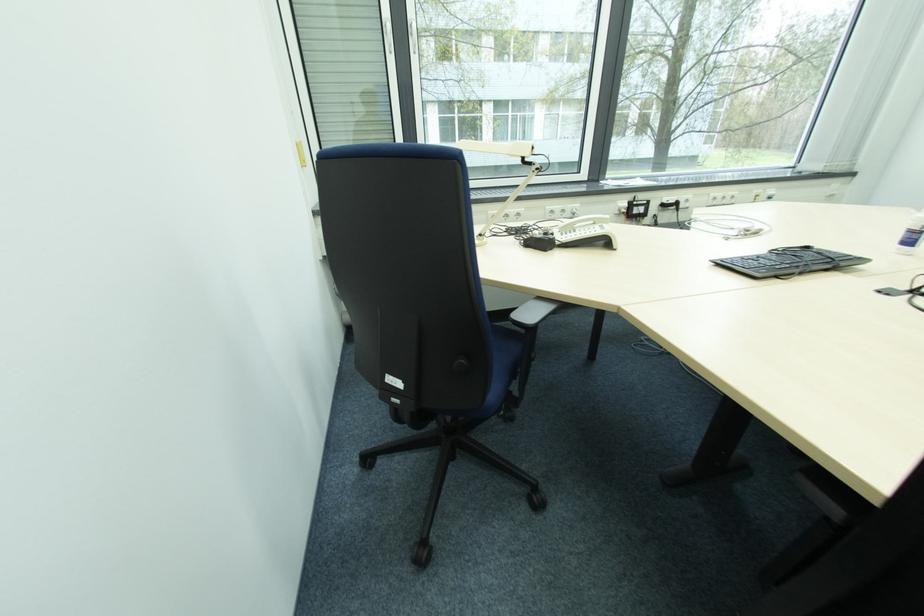
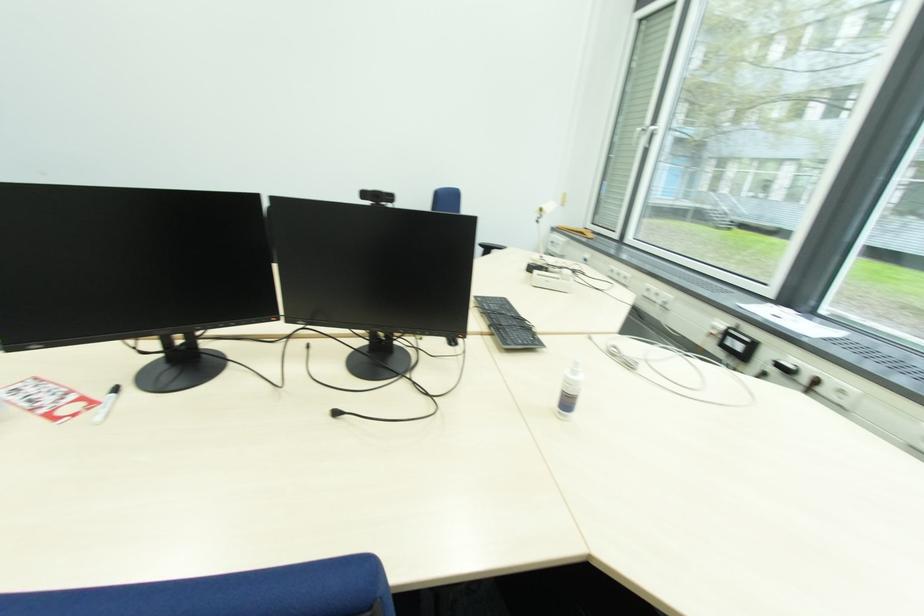
In the second image, find the point that corresponds to point (638, 205) in the first image.

(734, 333)